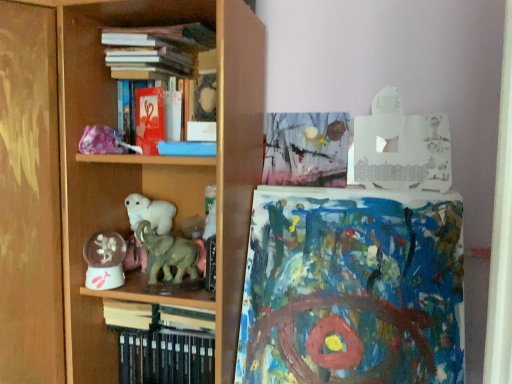
Question: From their relative heights in the image, would you say hardcover book at center, which is the second book in bottom-to-top order, is taller or shorter than translucent plastic snow globe at lower left?

Choices:
 (A) short
 (B) tall

Answer: (A)

Question: Considering their positions, is hardcover book at center, which is the 3th book in top-to-bottom order, located in front of or behind translucent plastic snow globe at lower left?

Choices:
 (A) behind
 (B) front

Answer: (A)

Question: Which object is the closest to the wooden shelf at center?

Choices:
 (A) green matte elephant at center
 (B) watercolor paper painting at upper center, which is counted as the second book, starting from the top
 (C) blue textured paper at center
 (D) translucent plastic snow globe at lower left
 (E) hardcover book at center, which is the second book in bottom-to-top order

Answer: (A)

Question: Considering the real-world distances, which object is farthest from the hardcover books at lower left, arranged as the 4th book when viewed from the top?

Choices:
 (A) hardcover books at upper center, acting as the 1th book starting from the top
 (B) green matte elephant at center
 (C) wooden shelf at center
 (D) blue textured paper at center
 (E) translucent plastic snow globe at lower left

Answer: (A)